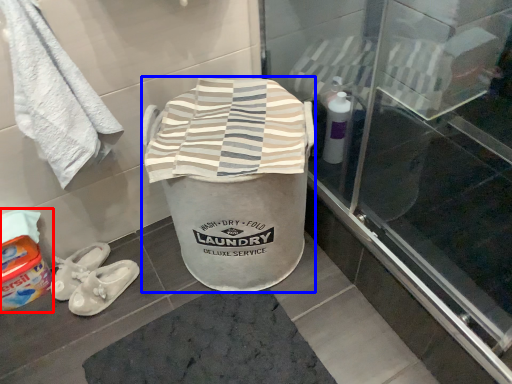
Question: Which point is further to the camera, wash (highlighted by a red box) or writing (highlighted by a blue box)?

Choices:
 (A) wash
 (B) writing

Answer: (A)